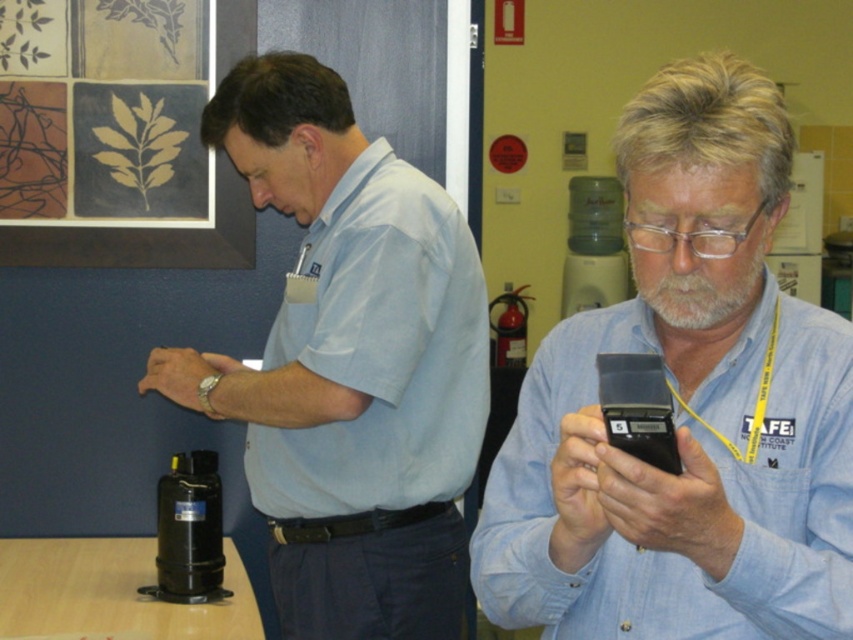
You are trying to determine which object is wider between the light blue cotton shirt at center and the black plastic smartphone at center. Based on the scene, can you tell which one is wider?

The light blue cotton shirt at center is wider than the black plastic smartphone at center according to the description.